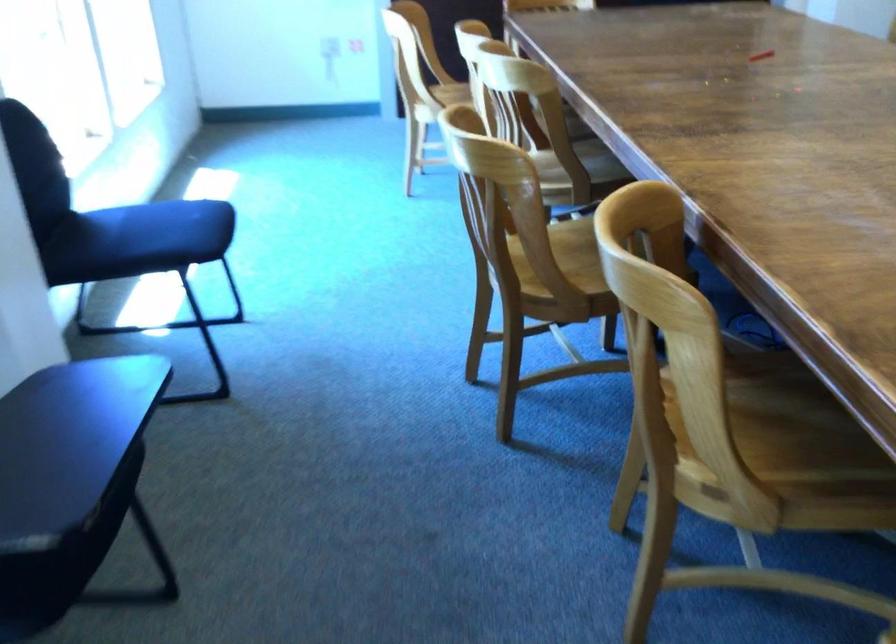
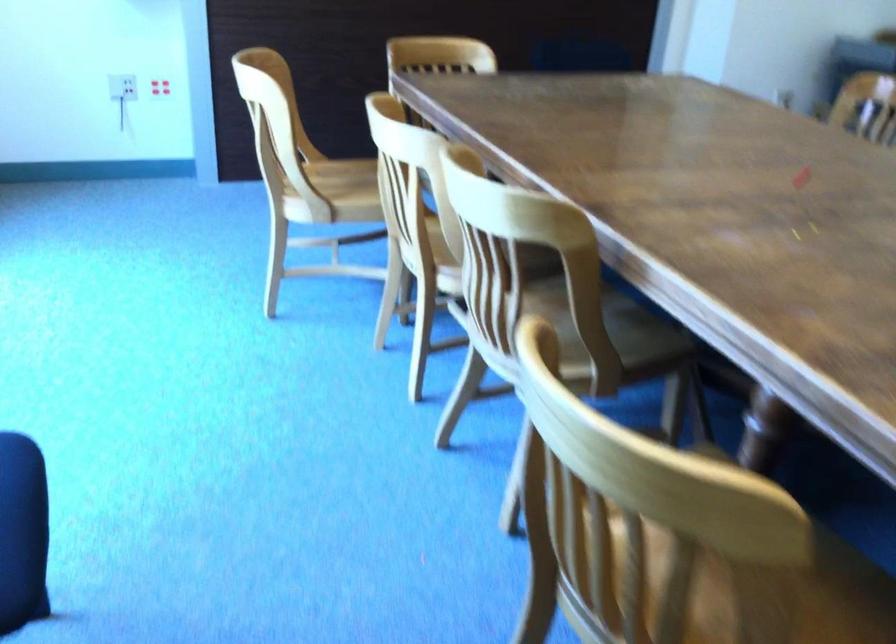
Find the pixel in the second image that matches pixel 497 201 in the first image.

(685, 570)